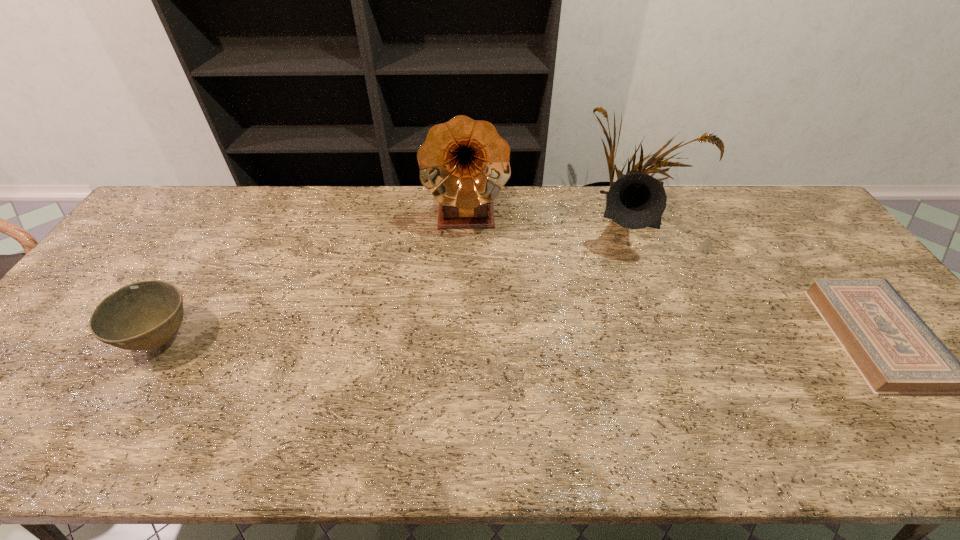
The image size is (960, 540). In order to click on vacant area situated 0.310m on the horn of the tallest object in this screenshot , I will do `click(468, 322)`.

The image size is (960, 540). What are the coordinates of `vacant space located 0.200m on the horn of the tallest object` in the screenshot? It's located at (468, 291).

Image resolution: width=960 pixels, height=540 pixels. In order to click on vacant space located 0.200m on the horn of the tallest object in this screenshot , I will do `click(468, 291)`.

Locate an element on the screen. This screenshot has height=540, width=960. vacant point at the far edge is located at coordinates (722, 207).

Find the location of a particular element. free space at the left edge of the desktop is located at coordinates (130, 242).

This screenshot has width=960, height=540. In the image, there is a desktop. Find the location of `vacant space at the right edge`. vacant space at the right edge is located at coordinates (821, 241).

In order to click on free space at the near left corner of the desktop in this screenshot , I will do `click(77, 386)`.

Locate an element on the screen. The width and height of the screenshot is (960, 540). vacant space at the far right corner is located at coordinates (802, 226).

The height and width of the screenshot is (540, 960). In order to click on unoccupied position between the second shortest object and the tallest object in this screenshot , I will do `click(315, 277)`.

Find the location of a particular element. vacant area that lies between the left phonograph_record and the third tallest object is located at coordinates (315, 277).